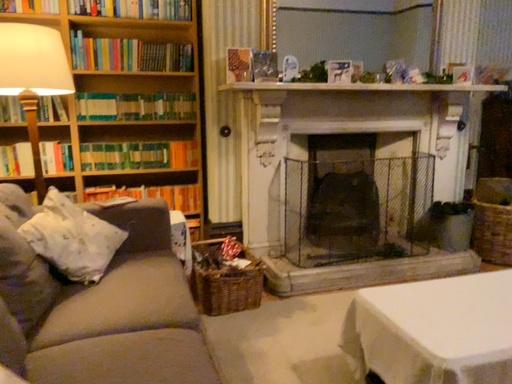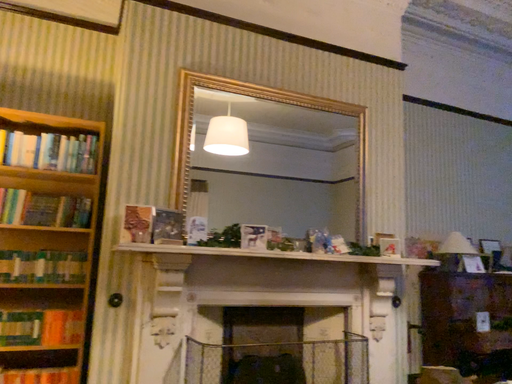
Question: How did the camera likely rotate when shooting the video?

Choices:
 (A) rotated downward
 (B) rotated upward

Answer: (B)